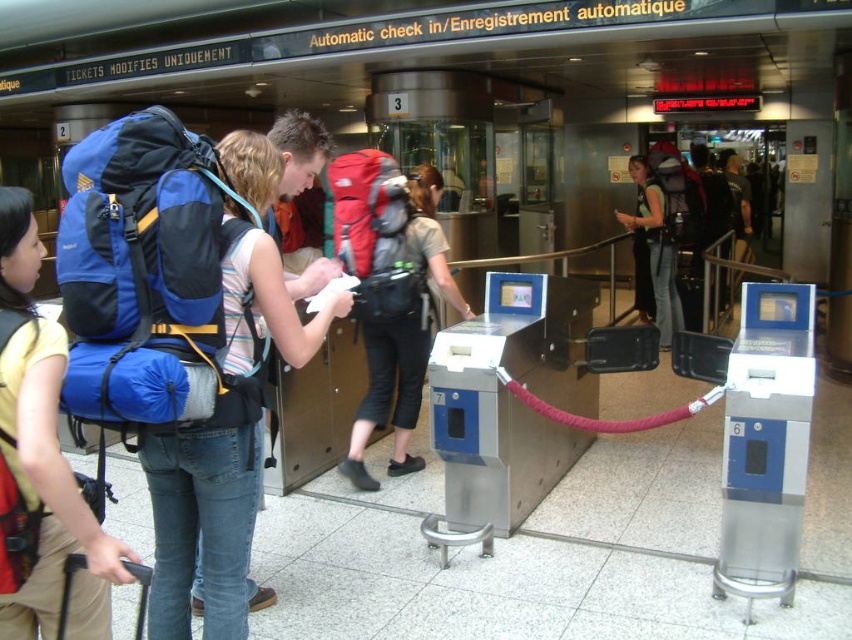
Question: Is the position of matte blue backpack at left more distant than that of matte red backpack at center?

Choices:
 (A) yes
 (B) no

Answer: (B)

Question: Can you confirm if blue fabric backpack at center is positioned above matte green backpack at center?

Choices:
 (A) yes
 (B) no

Answer: (B)

Question: Which point appears closest to the camera in this image?

Choices:
 (A) (240, 269)
 (B) (401, 352)
 (C) (38, 438)

Answer: (C)

Question: Does matte blue backpack at left appear on the left side of matte red backpack at center?

Choices:
 (A) no
 (B) yes

Answer: (B)

Question: Which point is closer to the camera?

Choices:
 (A) blue fabric backpack at center
 (B) matte red backpack at center

Answer: (A)

Question: Among these objects, which one is nearest to the camera?

Choices:
 (A) matte red backpack at center
 (B) blue fabric backpack at center
 (C) matte green backpack at center

Answer: (B)